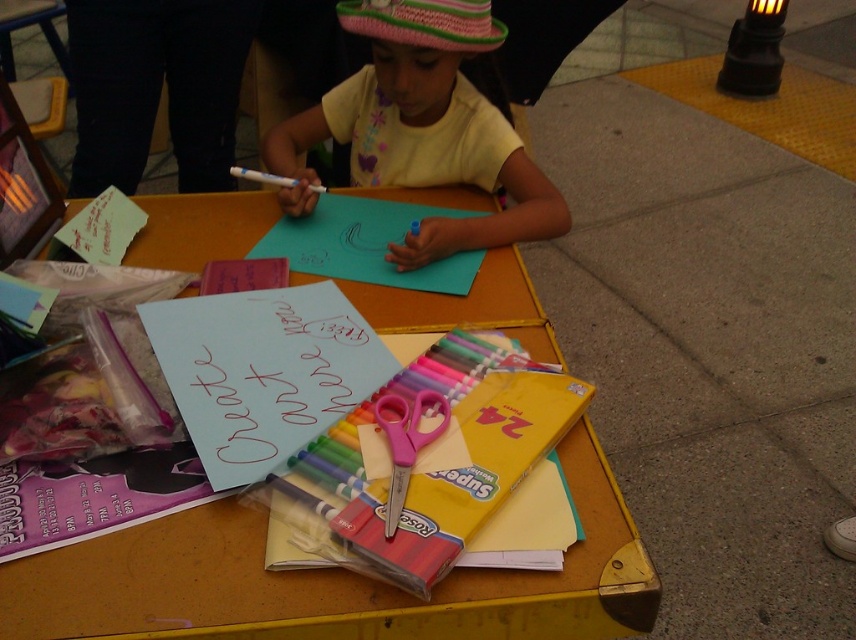
You are an art teacher setting up a craft station for a class of young children. You have a yellow cardboard table at center and pink plastic scissors at center. Which object has a greater width?

The yellow cardboard table at center has a greater width than the pink plastic scissors at center.

Where is point (x=330, y=582) located in the image?

The point is located on the yellow cardboard table at center.